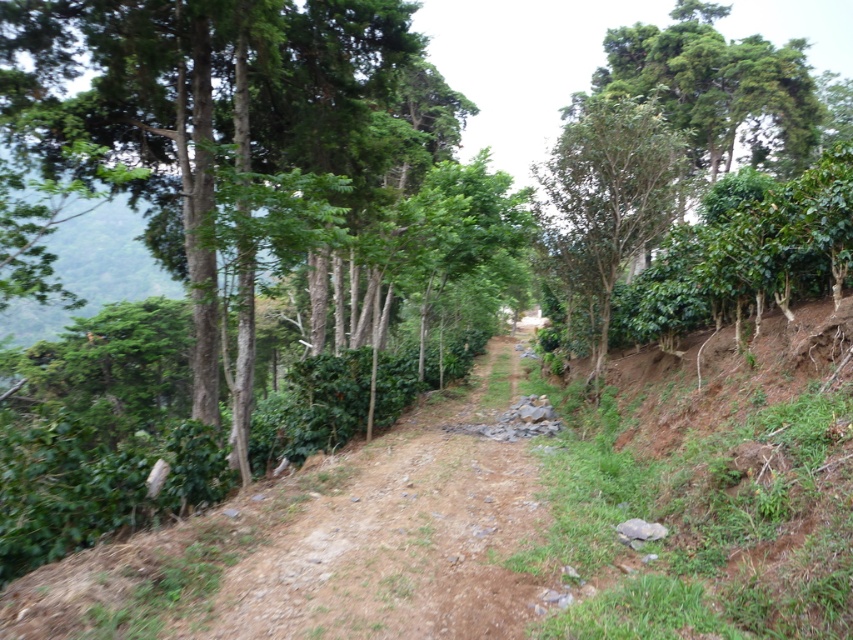
You are a hiker trying to navigate the dirt path at center. There is a green leafy tree at upper right nearby. From your perspective on the path, which side of the tree should you look towards to stay on the correct route?

The dirt path at center is to the left of the green leafy tree at upper right, so you should look towards the left side of the tree to stay on the correct route.